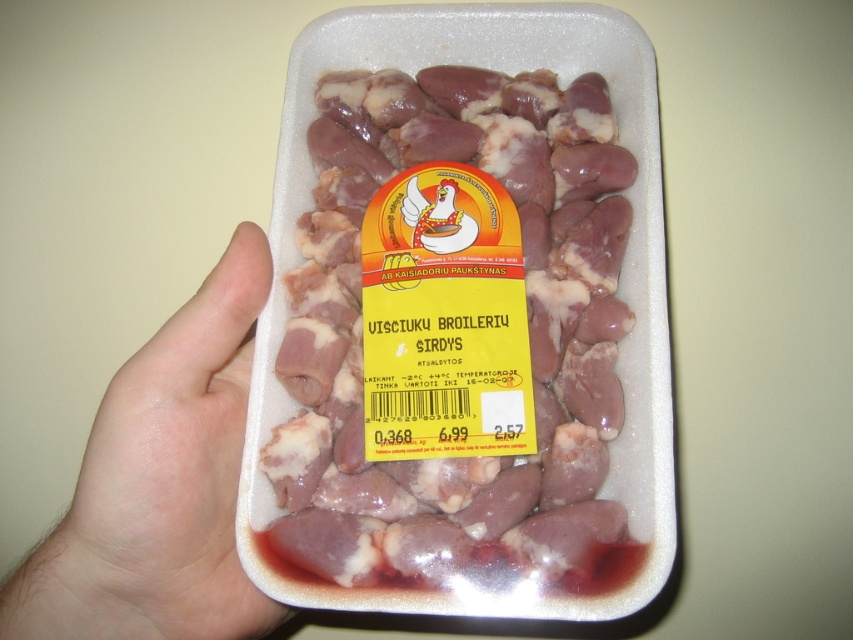
You are a food safety inspector examining the container holding the pinkish raw meat at center and the pale skin at center. Based on their positions, which one is more likely to be contaminated if the container was stored improperly?

The pinkish raw meat at center is more likely to be contaminated because it is located above the pale skin at center, and if the container was stored improperly, juices from the raw meat could drip onto the pale skin below, increasing contamination risk.